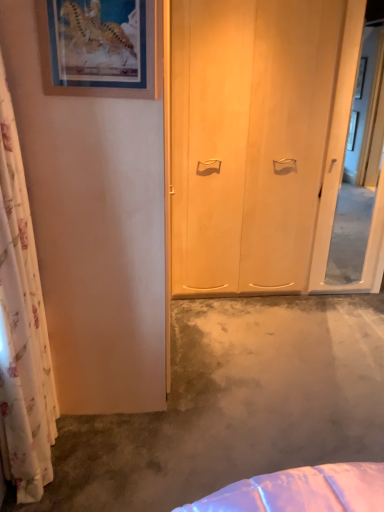
Question: From the image's perspective, is transparent glass screen door at right located above concreteroughconcrete at center?

Choices:
 (A) no
 (B) yes

Answer: (B)

Question: Considering the relative positions of transparent glass screen door at right and concreteroughconcrete at center in the image provided, is transparent glass screen door at right to the right of concreteroughconcrete at center from the viewer's perspective?

Choices:
 (A) yes
 (B) no

Answer: (A)

Question: Is transparent glass screen door at right in front of concreteroughconcrete at center?

Choices:
 (A) no
 (B) yes

Answer: (A)

Question: Considering the relative sizes of transparent glass screen door at right and concreteroughconcrete at center in the image provided, is transparent glass screen door at right taller than concreteroughconcrete at center?

Choices:
 (A) no
 (B) yes

Answer: (B)

Question: Is transparent glass screen door at right positioned behind concreteroughconcrete at center?

Choices:
 (A) no
 (B) yes

Answer: (B)

Question: Is concreteroughconcrete at center wider or thinner than transparent glass screen door at right?

Choices:
 (A) wide
 (B) thin

Answer: (A)

Question: Do you think concreteroughconcrete at center is within transparent glass screen door at right, or outside of it?

Choices:
 (A) inside
 (B) outside

Answer: (B)

Question: Is point (244, 316) positioned closer to the camera than point (347, 34)?

Choices:
 (A) closer
 (B) farther

Answer: (B)

Question: From a real-world perspective, is concreteroughconcrete at center positioned above or below transparent glass screen door at right?

Choices:
 (A) above
 (B) below

Answer: (B)

Question: Relative to transparent glass screen door at right, is wooden picture frame at upper left in front or behind?

Choices:
 (A) behind
 (B) front

Answer: (B)

Question: From the image's perspective, is wooden picture frame at upper left located above or below transparent glass screen door at right?

Choices:
 (A) above
 (B) below

Answer: (A)

Question: Do you think wooden picture frame at upper left is within transparent glass screen door at right, or outside of it?

Choices:
 (A) inside
 (B) outside

Answer: (B)

Question: Is point (44, 75) positioned closer to the camera than point (354, 211)?

Choices:
 (A) farther
 (B) closer

Answer: (B)

Question: Relative to transparent glass screen door at right, is white floral curtain at left in front or behind?

Choices:
 (A) front
 (B) behind

Answer: (A)

Question: Is white floral curtain at left bigger or smaller than transparent glass screen door at right?

Choices:
 (A) big
 (B) small

Answer: (A)